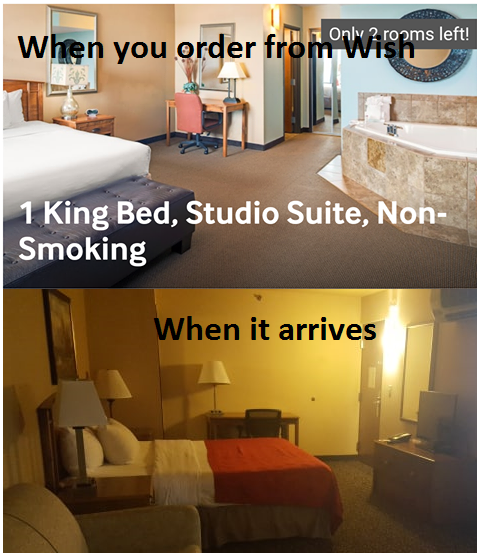
At what (x,y) coordinates should I click in order to perform the action: click on bathtub. Please return your answer as a coordinate pair (x, y). This screenshot has height=553, width=477. Looking at the image, I should click on (438, 143).